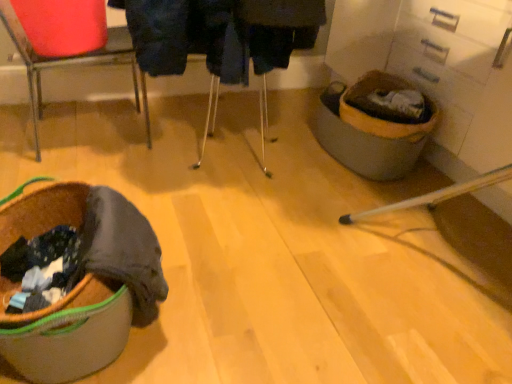
The height and width of the screenshot is (384, 512). I want to click on vacant space to the right of brown fabric laundry basket at lower left, so click(x=244, y=293).